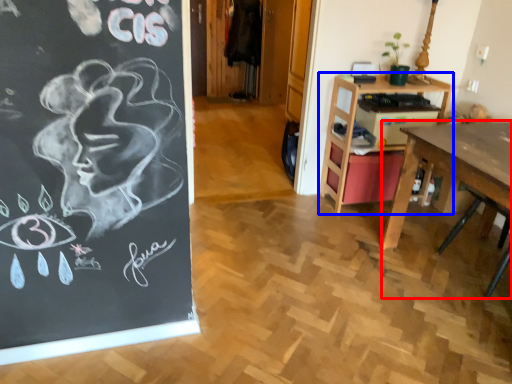
Question: Which object is closer to the camera taking this photo, desk (highlighted by a red box) or table (highlighted by a blue box)?

Choices:
 (A) desk
 (B) table

Answer: (A)